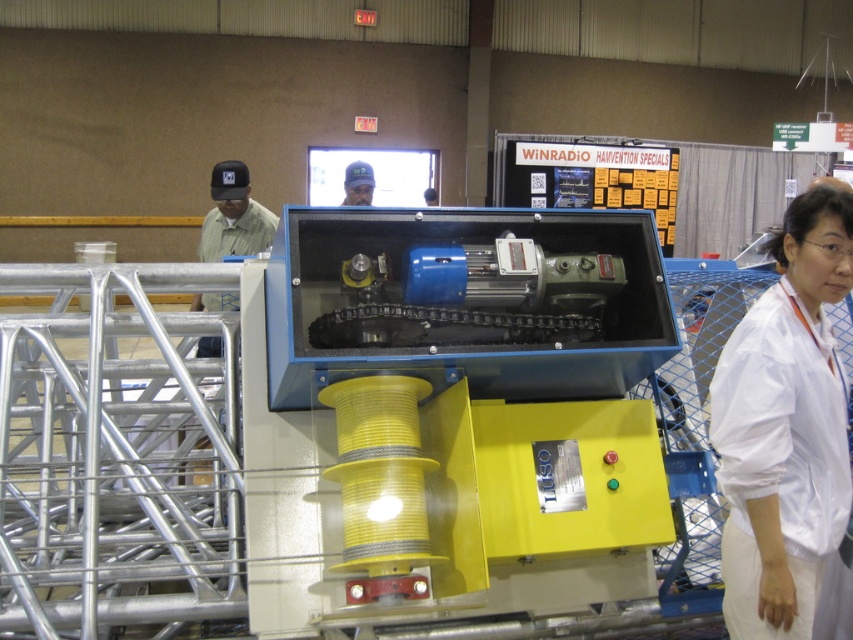
You are an engineer inspecting the machinery in the industrial setting. You notice a white fabric at right. Where exactly is it located in relation to the machinery?

The white fabric at right is located at point 0.667 on the x axis and 0.921 on the y axis relative to the machinery.

You are an event organizer setting up a booth at the WiNRadio HAMVENTION. You notice two fabrics in the image, the white fabric at right and the blue fabric cap at upper center. Which fabric is taller?

The white fabric at right is taller than the blue fabric cap at upper center.

You are an engineer inspecting the machinery in the industrial setting. You notice the white fabric at right and the blue fabric cap at upper center. Which fabric is nearer to your current position?

The white fabric at right is closer to the viewer than the blue fabric cap at upper center.